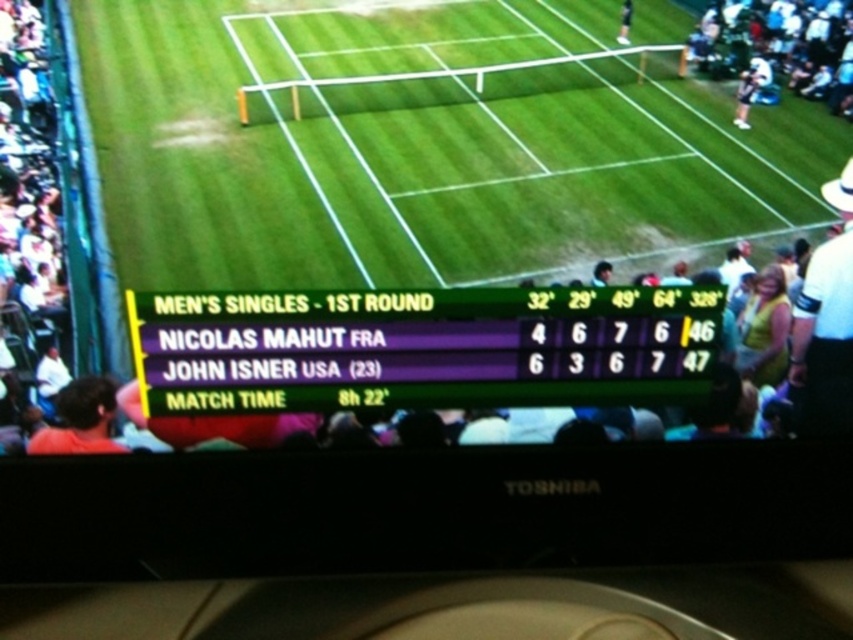
Is point (564, 296) behind point (90, 384)?

No.

Can you confirm if green plastic scoreboard at center is positioned above brown hair at lower left?

Correct, green plastic scoreboard at center is located above brown hair at lower left.

The image size is (853, 640). In order to click on green plastic scoreboard at center in this screenshot , I will do `click(421, 348)`.

Is green plastic scoreboard at center shorter than white hat at upper right?

Yes, green plastic scoreboard at center is shorter than white hat at upper right.

In order to click on green plastic scoreboard at center in this screenshot , I will do `click(421, 348)`.

Which is in front, point (329, 388) or point (813, 326)?

Point (329, 388) is more forward.

Locate an element on the screen. green plastic scoreboard at center is located at coordinates (421, 348).

Between point (283, 244) and point (102, 401), which one is positioned behind?

The point (283, 244) is more distant.

Between green grass tennis court at center and brown hair at lower left, which one has more height?

green grass tennis court at center

Is point (300, 100) positioned after point (84, 413)?

Yes, point (300, 100) is behind point (84, 413).

The image size is (853, 640). What are the coordinates of `green grass tennis court at center` in the screenshot? It's located at (422, 148).